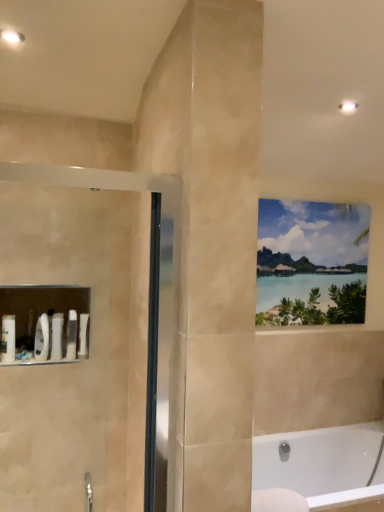
Question: Looking at their shapes, would you say watercolor painting at upper right is wider or thinner than white glossy bathtub at lower right?

Choices:
 (A) wide
 (B) thin

Answer: (B)

Question: Is watercolor painting at upper right inside the boundaries of white glossy bathtub at lower right, or outside?

Choices:
 (A) inside
 (B) outside

Answer: (B)

Question: From a real-world perspective, is watercolor painting at upper right physically located above or below white glossy bathtub at lower right?

Choices:
 (A) below
 (B) above

Answer: (B)

Question: In terms of height, does white glossy bathtub at lower right look taller or shorter compared to watercolor painting at upper right?

Choices:
 (A) short
 (B) tall

Answer: (A)

Question: From the image's perspective, is white glossy bathtub at lower right above or below watercolor painting at upper right?

Choices:
 (A) above
 (B) below

Answer: (B)

Question: Looking at their shapes, would you say white glossy bathtub at lower right is wider or thinner than watercolor painting at upper right?

Choices:
 (A) wide
 (B) thin

Answer: (A)

Question: Is point (317, 449) positioned closer to the camera than point (266, 206)?

Choices:
 (A) closer
 (B) farther

Answer: (B)